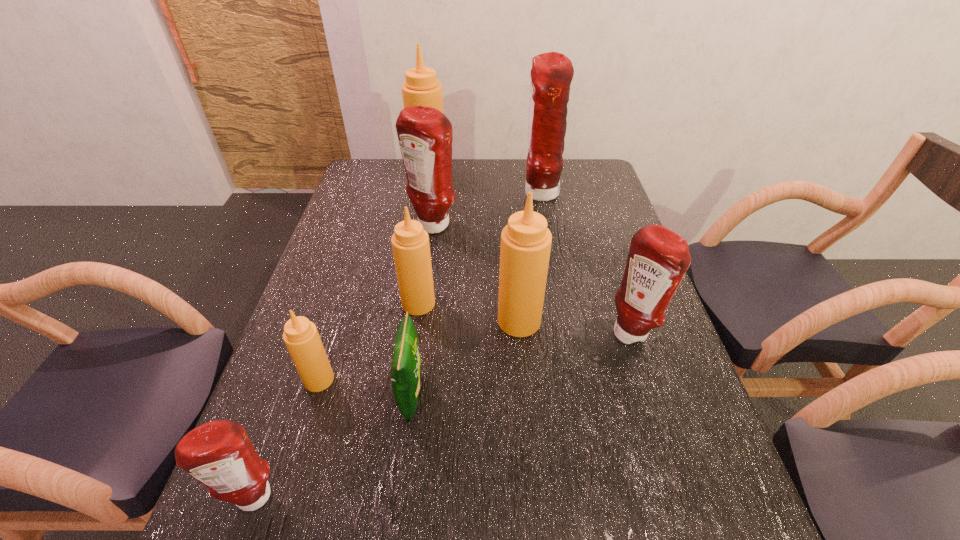
Find the location of a particular element. free space located 0.160m on the front of the second smallest red condiment is located at coordinates (657, 414).

Locate an element on the screen. Image resolution: width=960 pixels, height=540 pixels. free location located on the back of the smallest red condiment is located at coordinates (317, 323).

At what (x,y) coordinates should I click in order to perform the action: click on vacant space located 0.050m on the back of the nearest tan condiment. Please return your answer as a coordinate pair (x, y). This screenshot has height=540, width=960. Looking at the image, I should click on (328, 350).

I want to click on free region located on the front-facing side of the green crisp (potato chip), so click(609, 395).

Where is `object located at the right edge`? This screenshot has width=960, height=540. object located at the right edge is located at coordinates (658, 259).

Locate an element on the screen. This screenshot has width=960, height=540. free space at the left edge is located at coordinates (279, 366).

The image size is (960, 540). What are the coordinates of `vacant space at the right edge of the desktop` in the screenshot? It's located at (612, 272).

You are a GUI agent. You are given a task and a screenshot of the screen. Output one action in this format:
    pyautogui.click(x=<x>, y=<y>)
    Task: Click on the vacant space at the far left corner of the desktop
    
    Given the screenshot: What is the action you would take?
    pyautogui.click(x=383, y=164)

Locate an element on the screen. This screenshot has width=960, height=540. free space at the far right corner is located at coordinates (585, 171).

Find the location of a particular element. The width and height of the screenshot is (960, 540). vacant area that lies between the leftmost red condiment and the third smallest red condiment is located at coordinates (344, 362).